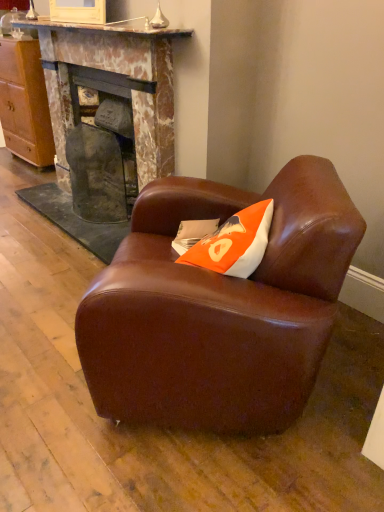
Question: Is rustic stone fireplace at center, arranged as the second fireplace when viewed from the right, at the right side of marble fireplace at center, the 1th fireplace from the right?

Choices:
 (A) no
 (B) yes

Answer: (A)

Question: Is marble fireplace at center, the 1th fireplace from the right, located within rustic stone fireplace at center, positioned as the first fireplace in left-to-right order?

Choices:
 (A) yes
 (B) no

Answer: (B)

Question: From the image's perspective, is rustic stone fireplace at center, arranged as the second fireplace when viewed from the right, located beneath marble fireplace at center, the second fireplace positioned from the left?

Choices:
 (A) no
 (B) yes

Answer: (B)

Question: Is rustic stone fireplace at center, positioned as the first fireplace in left-to-right order, to the left of marble fireplace at center, the second fireplace positioned from the left, from the viewer's perspective?

Choices:
 (A) no
 (B) yes

Answer: (B)

Question: Does rustic stone fireplace at center, arranged as the second fireplace when viewed from the right, have a larger size compared to marble fireplace at center, the second fireplace positioned from the left?

Choices:
 (A) yes
 (B) no

Answer: (B)

Question: Is rustic stone fireplace at center, arranged as the second fireplace when viewed from the right, looking in the opposite direction of marble fireplace at center, the 1th fireplace from the right?

Choices:
 (A) no
 (B) yes

Answer: (B)

Question: Is marble fireplace at center, the 1th fireplace from the right, wider than brown leather armchair at center?

Choices:
 (A) yes
 (B) no

Answer: (B)

Question: Is marble fireplace at center, the second fireplace positioned from the left, shorter than brown leather armchair at center?

Choices:
 (A) yes
 (B) no

Answer: (B)

Question: From the image's perspective, is marble fireplace at center, the second fireplace positioned from the left, beneath brown leather armchair at center?

Choices:
 (A) yes
 (B) no

Answer: (B)

Question: From a real-world perspective, is marble fireplace at center, the 1th fireplace from the right, on top of brown leather armchair at center?

Choices:
 (A) yes
 (B) no

Answer: (A)

Question: Is marble fireplace at center, the second fireplace positioned from the left, thinner than brown leather armchair at center?

Choices:
 (A) yes
 (B) no

Answer: (A)

Question: Is marble fireplace at center, the 1th fireplace from the right, taller than brown leather armchair at center?

Choices:
 (A) no
 (B) yes

Answer: (B)

Question: Is brown leather armchair at center aimed at orange fabric pillow at center?

Choices:
 (A) no
 (B) yes

Answer: (B)